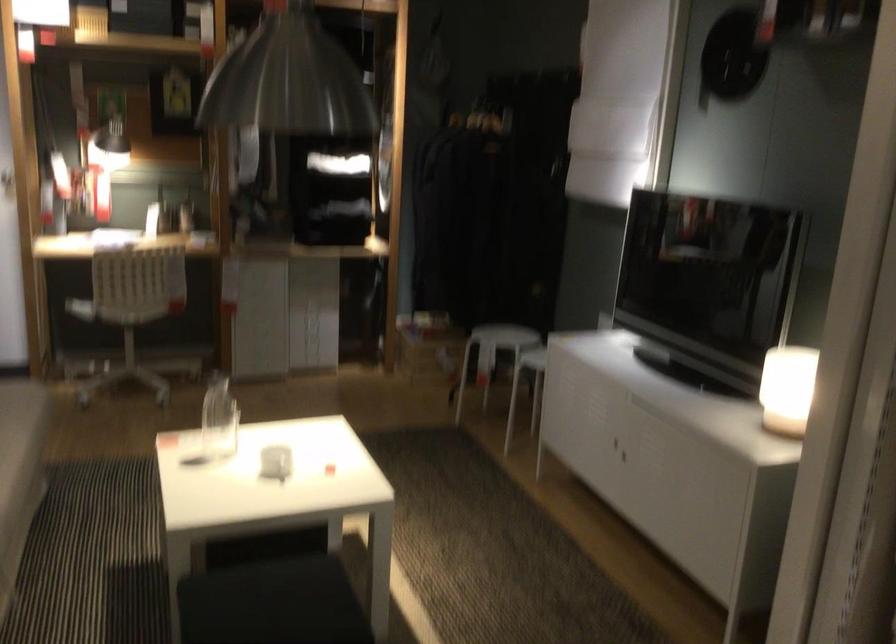
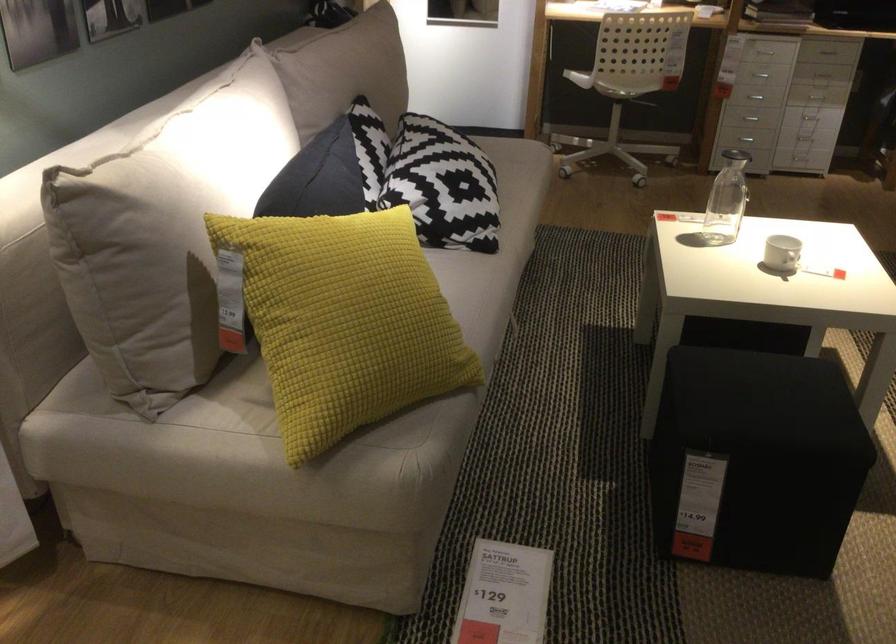
Find the pixel in the second image that matches (x=306, y=283) in the first image.

(826, 51)